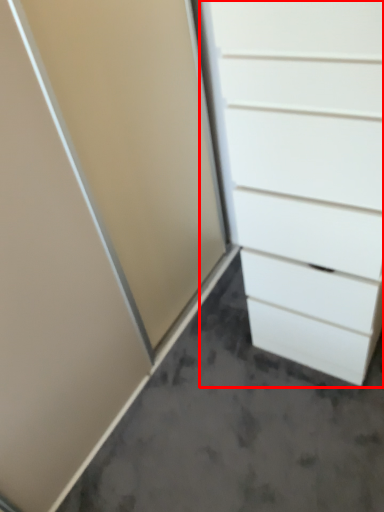
Question: From the image, what is the correct spatial relationship of chest of drawers (annotated by the red box) in relation to concrete?

Choices:
 (A) left
 (B) right

Answer: (B)